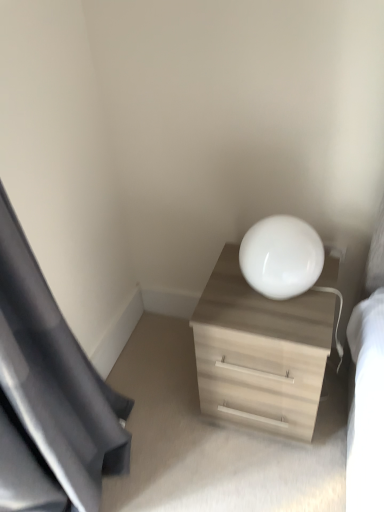
Question: From a real-world perspective, does white glossy lampshade at upper right sit lower than light wood dresser at center?

Choices:
 (A) no
 (B) yes

Answer: (A)

Question: Is white glossy lampshade at upper right outside of light wood dresser at center?

Choices:
 (A) no
 (B) yes

Answer: (B)

Question: From a real-world perspective, is white glossy lampshade at upper right on top of light wood dresser at center?

Choices:
 (A) no
 (B) yes

Answer: (B)

Question: Can you confirm if white glossy lampshade at upper right is thinner than light wood dresser at center?

Choices:
 (A) no
 (B) yes

Answer: (B)

Question: From the image's perspective, is white glossy lampshade at upper right located above light wood dresser at center?

Choices:
 (A) yes
 (B) no

Answer: (A)

Question: Can you confirm if white glossy lampshade at upper right is bigger than light wood dresser at center?

Choices:
 (A) no
 (B) yes

Answer: (A)

Question: From a real-world perspective, is black fabric curtain at left located beneath white glossy lampshade at upper right?

Choices:
 (A) yes
 (B) no

Answer: (B)

Question: From a real-world perspective, is black fabric curtain at left located higher than white glossy lampshade at upper right?

Choices:
 (A) yes
 (B) no

Answer: (A)

Question: From the image's perspective, is black fabric curtain at left located beneath white glossy lampshade at upper right?

Choices:
 (A) no
 (B) yes

Answer: (B)

Question: Considering the relative positions of black fabric curtain at left and white glossy lampshade at upper right in the image provided, is black fabric curtain at left to the right of white glossy lampshade at upper right from the viewer's perspective?

Choices:
 (A) no
 (B) yes

Answer: (A)

Question: Does black fabric curtain at left appear on the left side of white glossy lampshade at upper right?

Choices:
 (A) no
 (B) yes

Answer: (B)

Question: Can you confirm if black fabric curtain at left is bigger than white glossy lampshade at upper right?

Choices:
 (A) yes
 (B) no

Answer: (A)

Question: Is light wood dresser at center outside black fabric curtain at left?

Choices:
 (A) yes
 (B) no

Answer: (A)